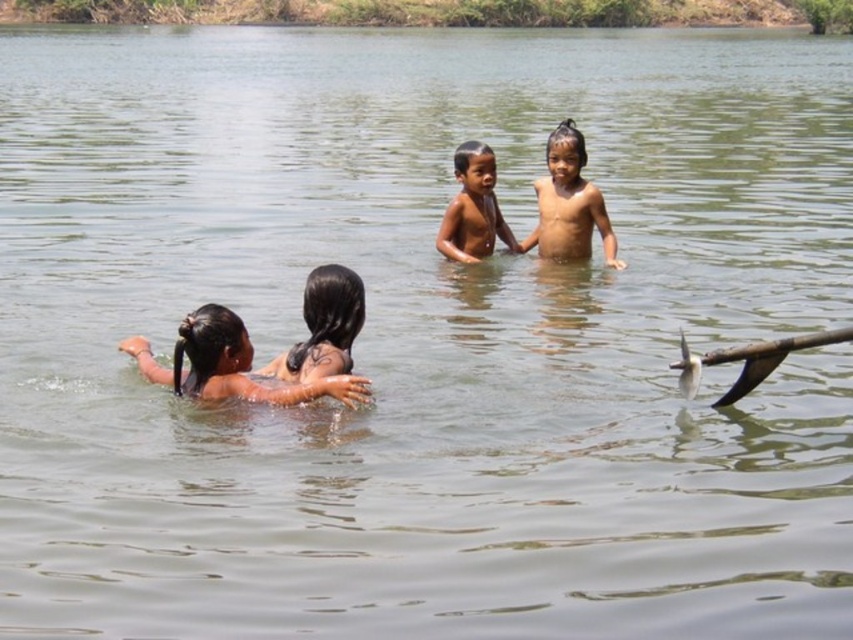
Question: Which object is the farthest from the dark skin/soft hair at center?

Choices:
 (A) brown skin child at center
 (B) black rubber paddle at lower right

Answer: (A)

Question: Can you confirm if dark skin/soft hair at center is bigger than dark brown hair at center?

Choices:
 (A) yes
 (B) no

Answer: (A)

Question: Is dark skin/soft hair at center closer to camera compared to brown skin child at upper center?

Choices:
 (A) no
 (B) yes

Answer: (B)

Question: Which of these objects is positioned farthest from the brown skin child at center?

Choices:
 (A) black rubber paddle at lower right
 (B) dark brown hair at center
 (C) dark skin/soft hair at center

Answer: (A)

Question: Observing the image, what is the correct spatial positioning of dark skin/soft hair at center in reference to brown skin child at center?

Choices:
 (A) above
 (B) below

Answer: (B)

Question: Which object appears farthest from the camera in this image?

Choices:
 (A) dark brown hair at center
 (B) black rubber paddle at lower right
 (C) brown skin child at center
 (D) dark skin/soft hair at center

Answer: (C)